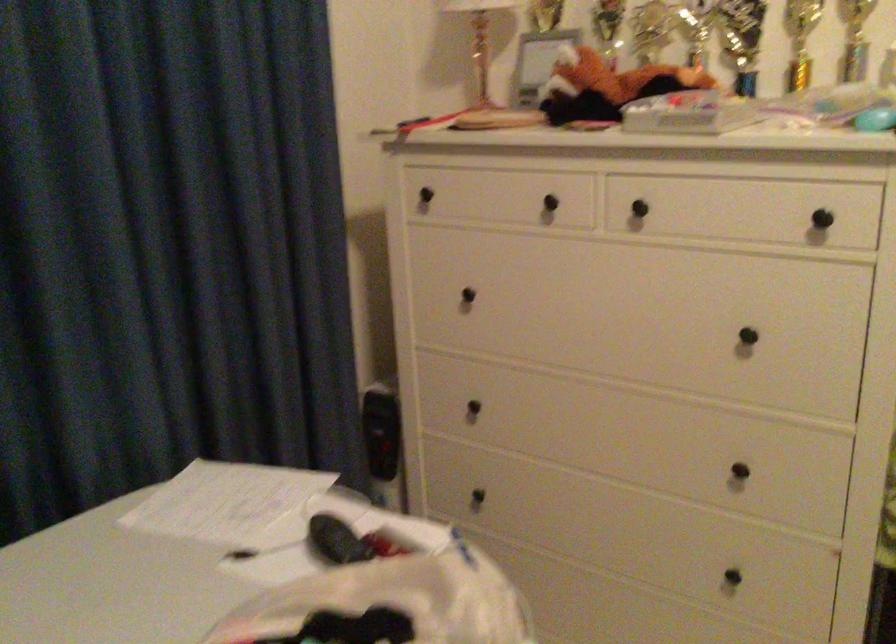
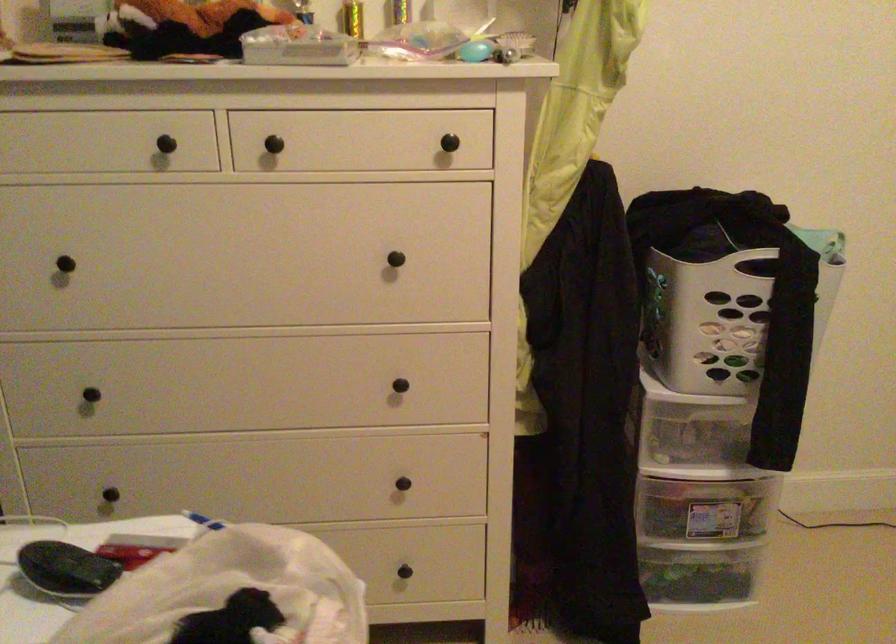
Find the pixel in the second image that matches (332,542) in the first image.

(65, 569)